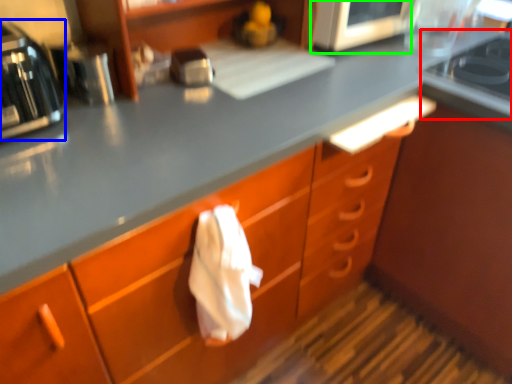
Question: Which is nearer to the gas stove (highlighted by a red box)? home appliance (highlighted by a blue box) or appliance (highlighted by a green box).

Choices:
 (A) home appliance
 (B) appliance

Answer: (B)